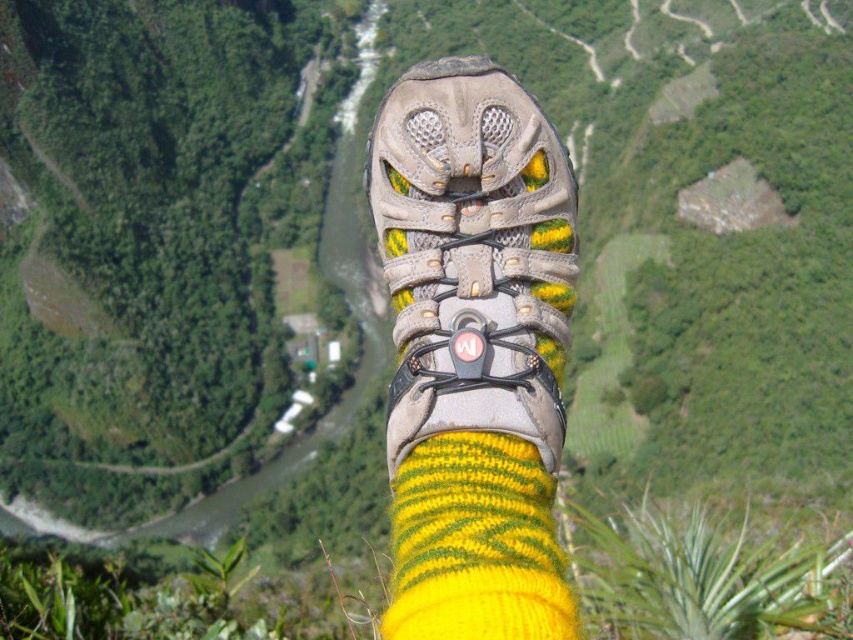
You are trying to decide whether to wear the matte gray shoe at center with the yellow knitted sock at center. Considering their sizes, will the sock fit comfortably inside the shoe?

The matte gray shoe at center is bigger than the yellow knitted sock at center, so the sock should fit comfortably inside the shoe as there will be enough space.

What object is located at the coordinates point [473,257]?

The object at point [473,257] is the matte gray shoe at center.

You are planning to put on a pair of hiking boots. You have the matte gray shoe at center and the yellow knitted sock at center. Which item should you put on first based on their sizes?

The yellow knitted sock at center should be put on first since the matte gray shoe at center is wider than the sock, meaning the sock can fit inside the shoe.